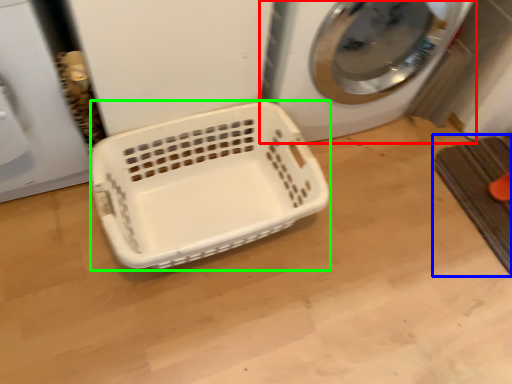
Question: Estimate the real-world distances between objects in this image. Which object is closer to washing machine (highlighted by a red box), bath mat (highlighted by a blue box) or basket (highlighted by a green box)?

Choices:
 (A) bath mat
 (B) basket

Answer: (B)